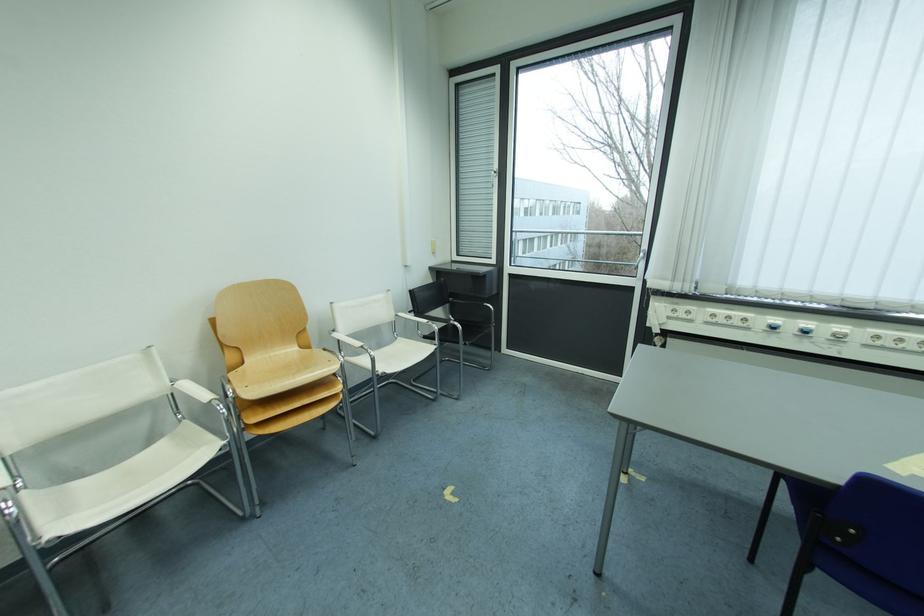
This screenshot has width=924, height=616. What do you see at coordinates (493, 176) in the screenshot? I see `a white window handle` at bounding box center [493, 176].